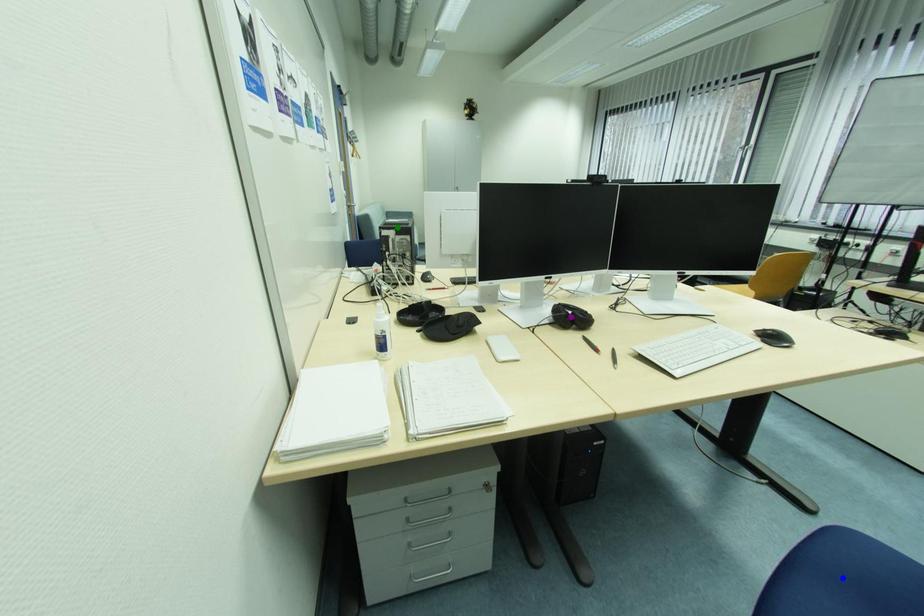
Order these from nearest to farthest:
purple point, blue point, green point

green point, purple point, blue point